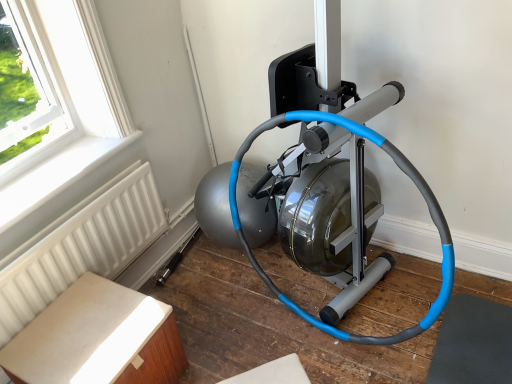
The width and height of the screenshot is (512, 384). Identify the location of blank space situated above white plastic radiator at lower left (from a real-world perspective). (62, 166).